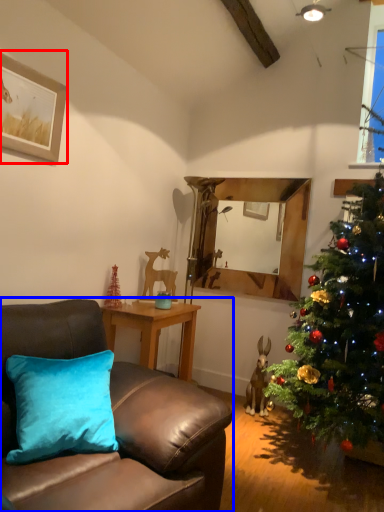
Question: Which object is closer to the camera taking this photo, picture frame (highlighted by a red box) or studio couch (highlighted by a blue box)?

Choices:
 (A) picture frame
 (B) studio couch

Answer: (B)